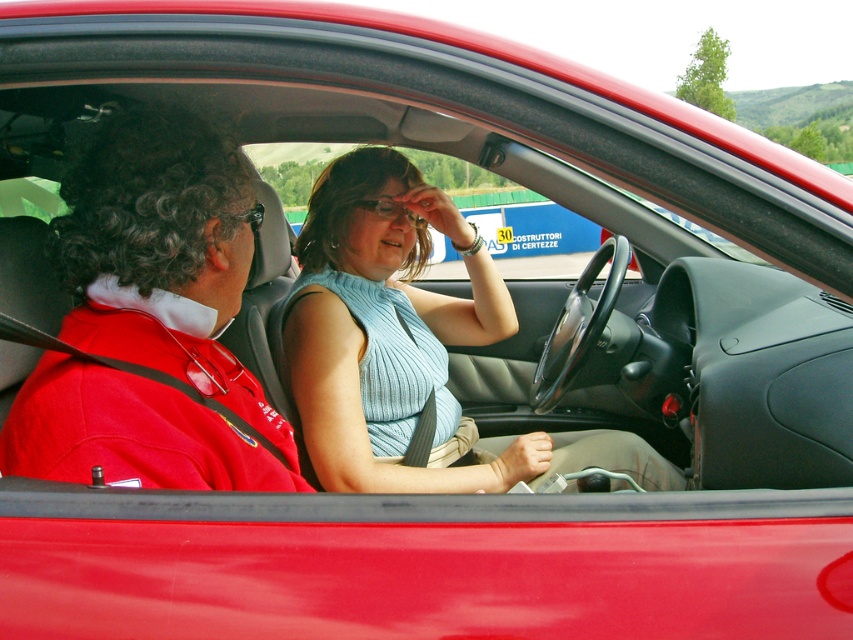
You are a passenger in a car and want to hand a map to the driver wearing the red fabric jacket at left. Since you are sitting in the light blue ribbed tank top at center, which direction should you turn to reach the driver?

You should turn to your left to hand the map to the driver wearing the red fabric jacket at left since the red fabric jacket at left is to the left of the light blue ribbed tank top at center.

You are standing 1.38 meters away from the red fabric jacket at left. Can you reach the jacket if you extend your arm fully?

The red fabric jacket at left is 1.38 meters away from you, so if you can extend your arm fully to at least 1.38 meters, you can reach it. However, the average human arm length is about 0.7 meters, so you might need to take a step closer.